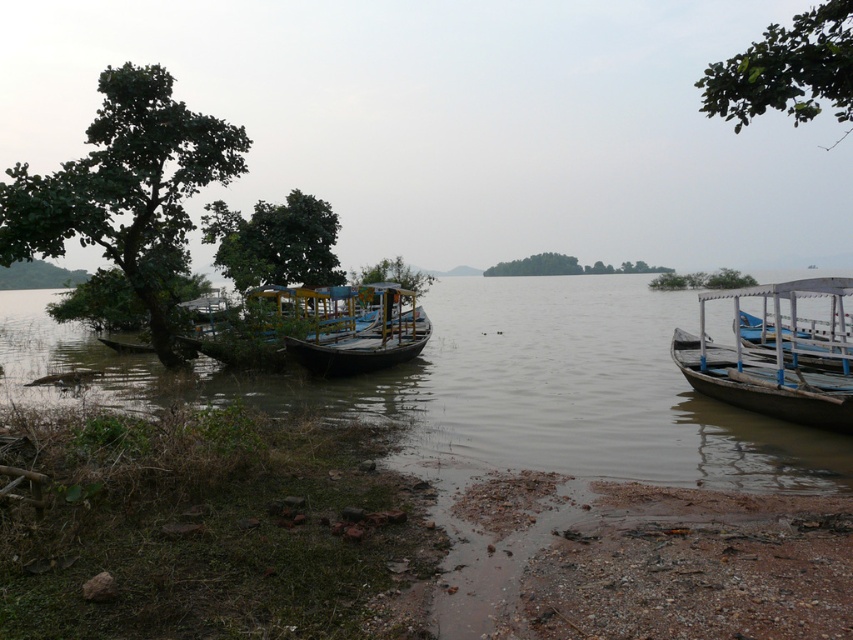
Question: Does green leafy tree at upper right appear on the left side of green leafy island at center?

Choices:
 (A) yes
 (B) no

Answer: (B)

Question: Among these points, which one is farthest from the camera?

Choices:
 (A) [426, 324]
 (B) [248, 346]

Answer: (A)

Question: Which is farther from the green matte tree at center?

Choices:
 (A) green leafy tree at left
 (B) wooden boat at center-left

Answer: (A)

Question: Is wooden boat at right bigger than green leafy tree at upper right?

Choices:
 (A) no
 (B) yes

Answer: (A)

Question: Among these points, which one is nearest to the camera?

Choices:
 (A) (407, 282)
 (B) (247, 275)
 (C) (260, 362)
 (D) (183, 124)

Answer: (D)

Question: Can you confirm if wooden boat at right is positioned above green leafy island at center?

Choices:
 (A) yes
 (B) no

Answer: (B)